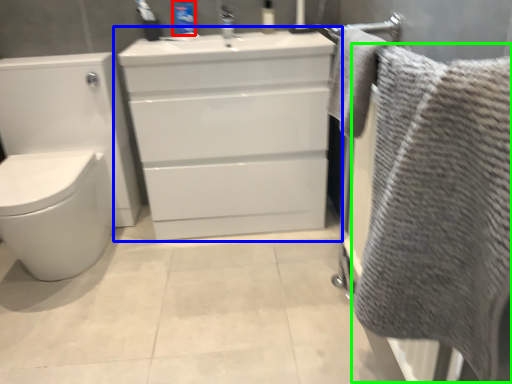
Question: Which object is positioned closest to toiletry (highlighted by a red box)? Select from bathroom cabinet (highlighted by a blue box) and bath towel (highlighted by a green box).

Choices:
 (A) bathroom cabinet
 (B) bath towel

Answer: (A)